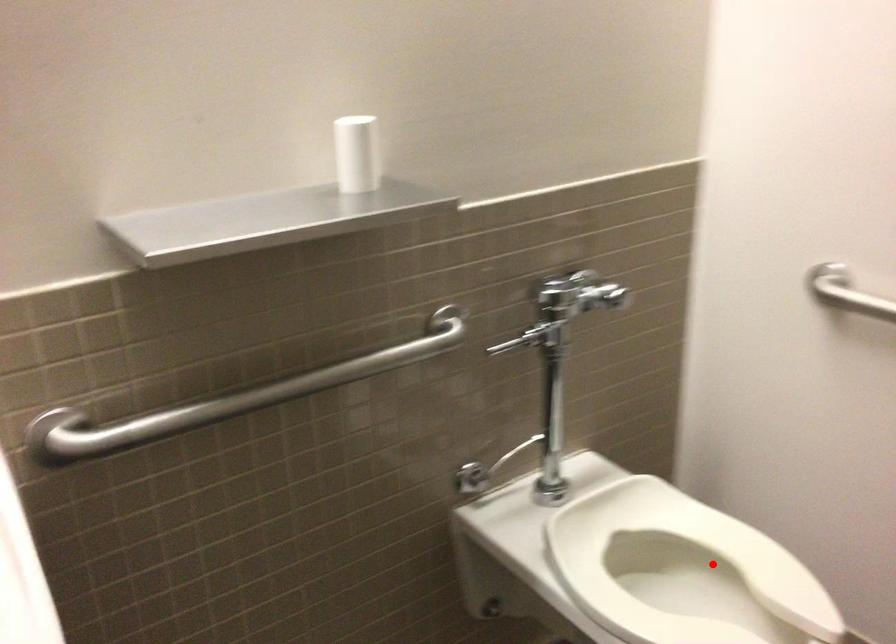
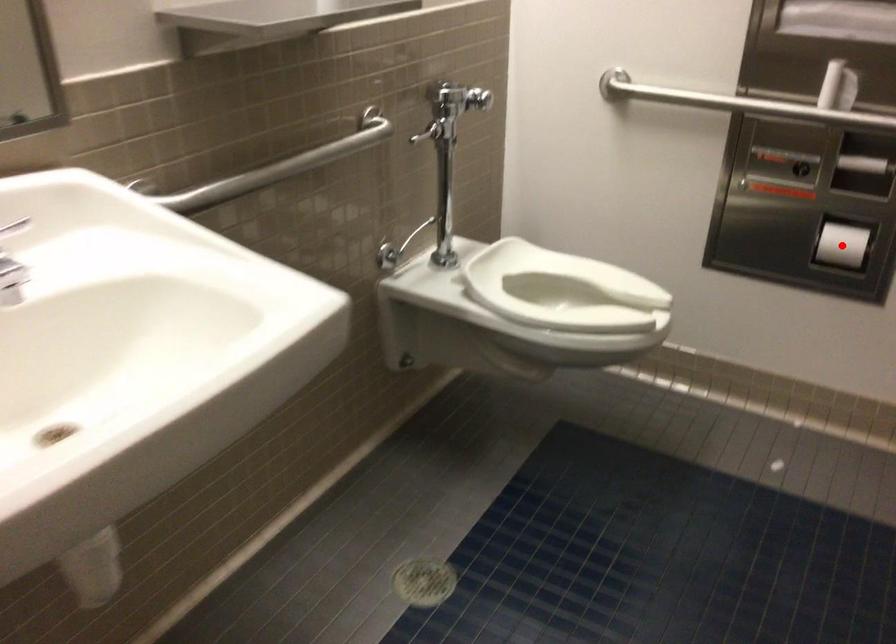
I am providing you with two images of the same scene from different viewpoints. A red point is marked on the first image and another point is marked on the second image. Is the red point in image1 aligned with the point shown in image2?

No